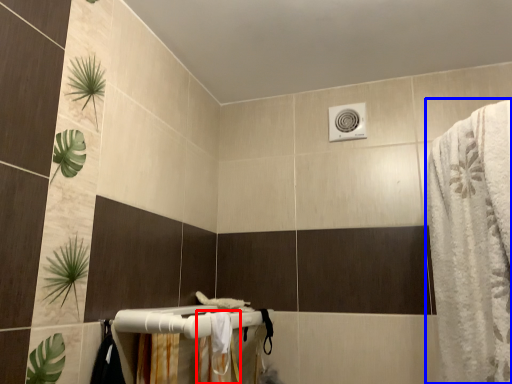
Question: Which of the following is the closest to the observer, shower curtain (highlighted by a red box) or bath towel (highlighted by a blue box)?

Choices:
 (A) shower curtain
 (B) bath towel

Answer: (B)